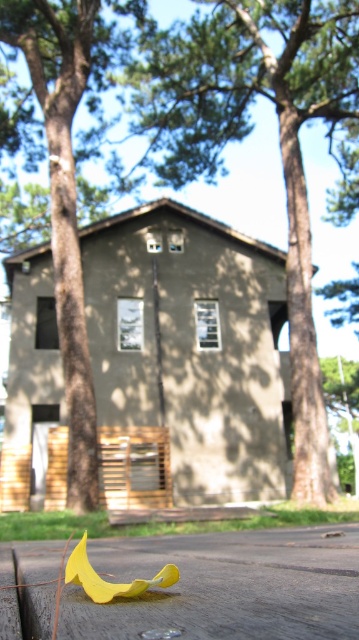
You are standing in front of the building and want to hang a wreath on the door. Which object, the brown textured wood at center or the brown wood tree at center, is closer to the door for hanging the wreath?

The brown textured wood at center is located above the brown wood tree at center, so the brown wood tree at center is closer to the door and better for hanging the wreath.

Consider the image. You are an architect designing a new outdoor space and want to ensure the brown textured wood at center and the brown wood tree at center are visible from the main path. Given their sizes, which object will appear more prominent when viewed from a distance?

The brown textured wood at center has a larger size compared to the brown wood tree at center, so it will appear more prominent when viewed from a distance.

You are standing in front of the building and want to know which object is taller between the brown textured wood at center and the brown wood tree at center. Can you tell me?

The brown textured wood at center is taller than the brown wood tree at center.